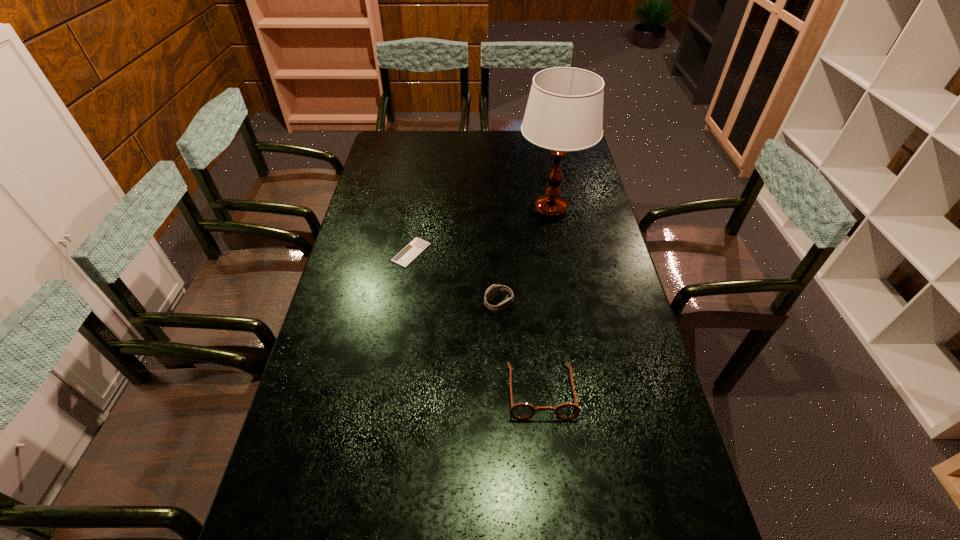
This screenshot has width=960, height=540. I want to click on the farthest object, so click(x=564, y=112).

Image resolution: width=960 pixels, height=540 pixels. In order to click on table lamp in this screenshot , I will do `click(564, 112)`.

Where is `spectacles`? Image resolution: width=960 pixels, height=540 pixels. spectacles is located at coordinates (521, 411).

Where is `the second nearest object`? The image size is (960, 540). the second nearest object is located at coordinates (494, 290).

This screenshot has height=540, width=960. What are the coordinates of `the third nearest object` in the screenshot? It's located at pos(416,246).

You are a GUI agent. You are given a task and a screenshot of the screen. Output one action in this format:
    pyautogui.click(x=<x>, y=<y>)
    Task: Click on the leftmost object
    
    Given the screenshot: What is the action you would take?
    pyautogui.click(x=416, y=246)

I want to click on free space located 0.130m on the front of the tallest object, so click(560, 257).

Find the location of a particular element. vacant space located on the front-facing side of the nearest object is located at coordinates (550, 481).

Locate an element on the screen. The image size is (960, 540). vacant space situated 0.330m on the face of the third farthest object is located at coordinates (376, 304).

The height and width of the screenshot is (540, 960). What are the coordinates of `vacant position located 0.110m on the face of the third farthest object` in the screenshot? It's located at (448, 304).